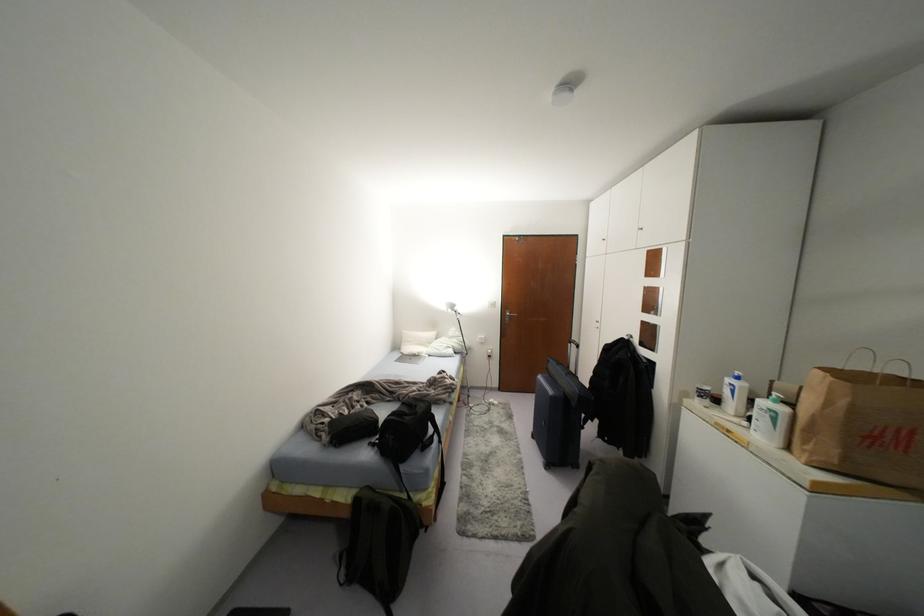
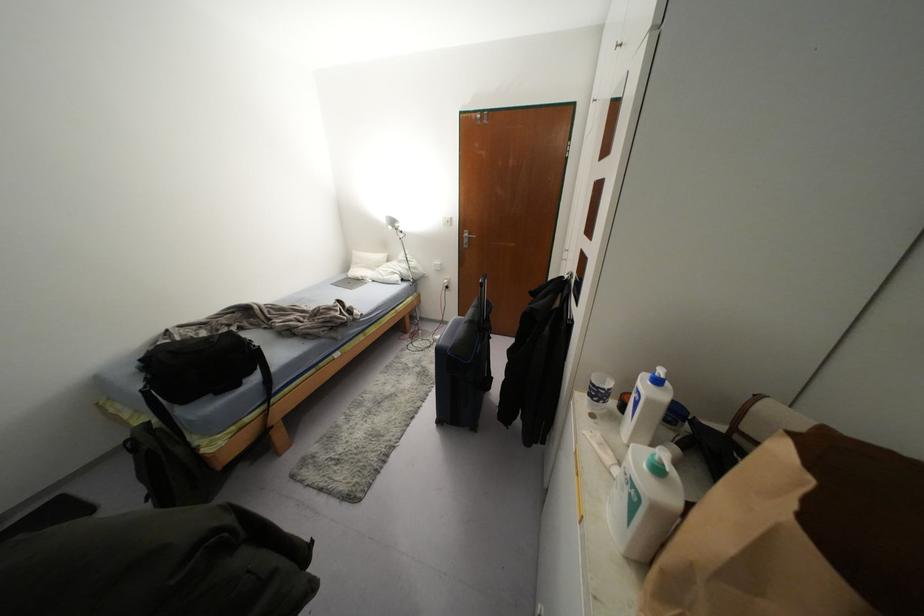
In the second image, find the point that corresponds to pixel 415 357 in the first image.

(358, 281)